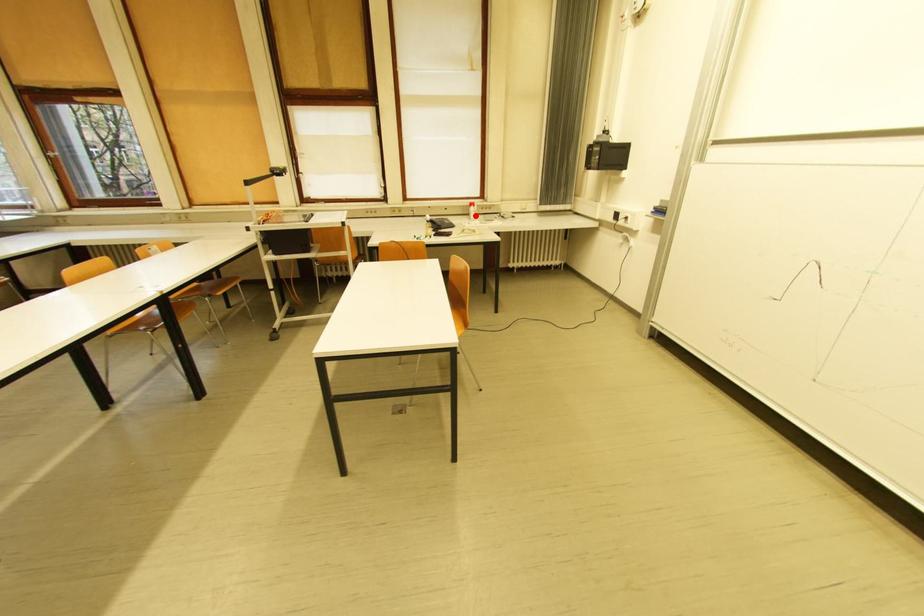
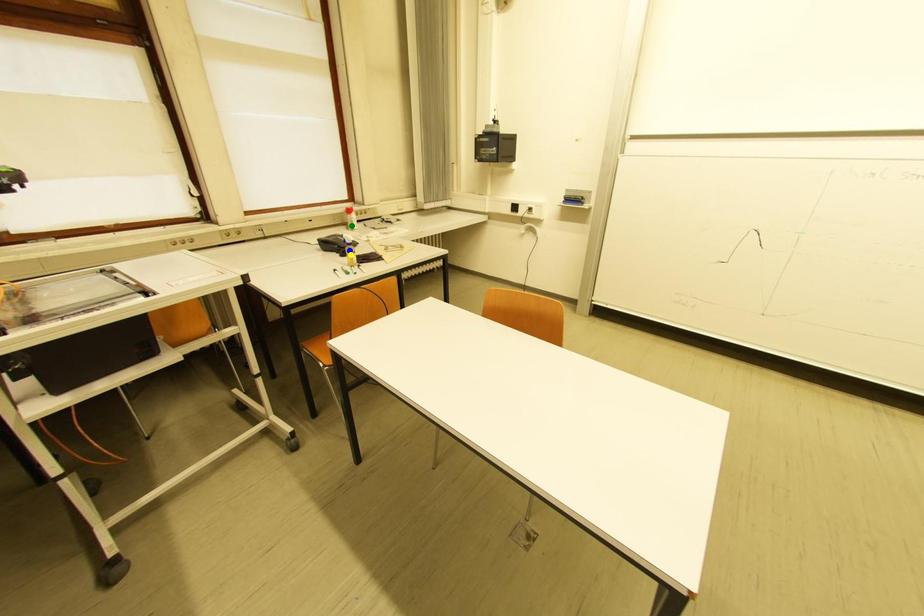
Question: I am providing you with two images of the same scene from different viewpoints. A red point is marked on the first image. You are given multiple points on the second image. Which point in image 2 represents the same 3d spot as the red point in image 1?

Choices:
 (A) blue point
 (B) yellow point
 (C) green point

Answer: (C)